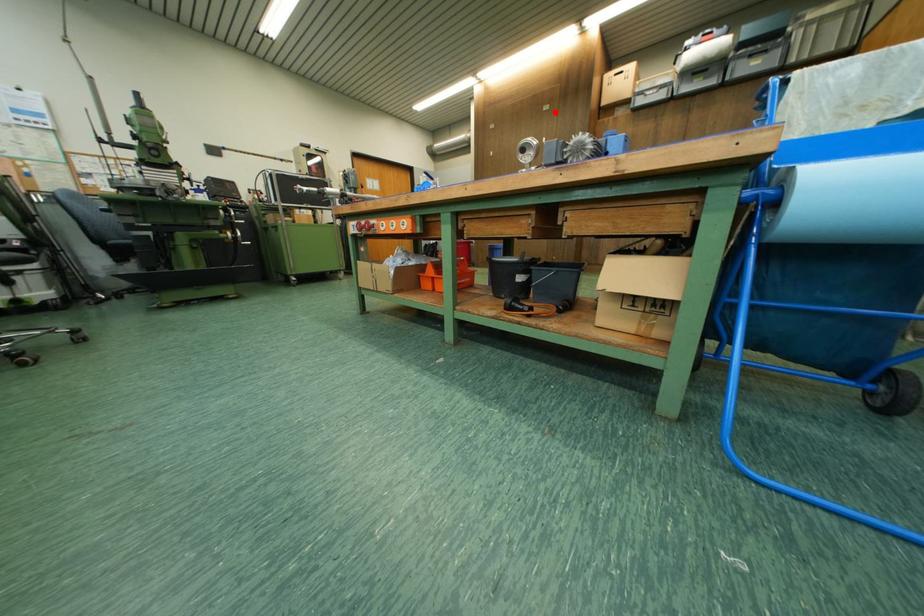
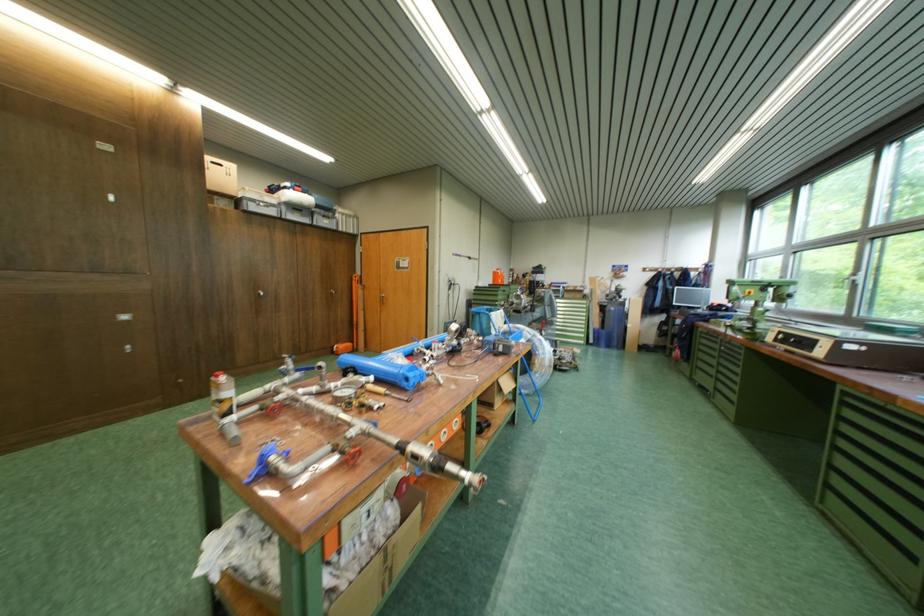
In the second image, find the point that corresponds to the highlighted location in the first image.

(110, 150)